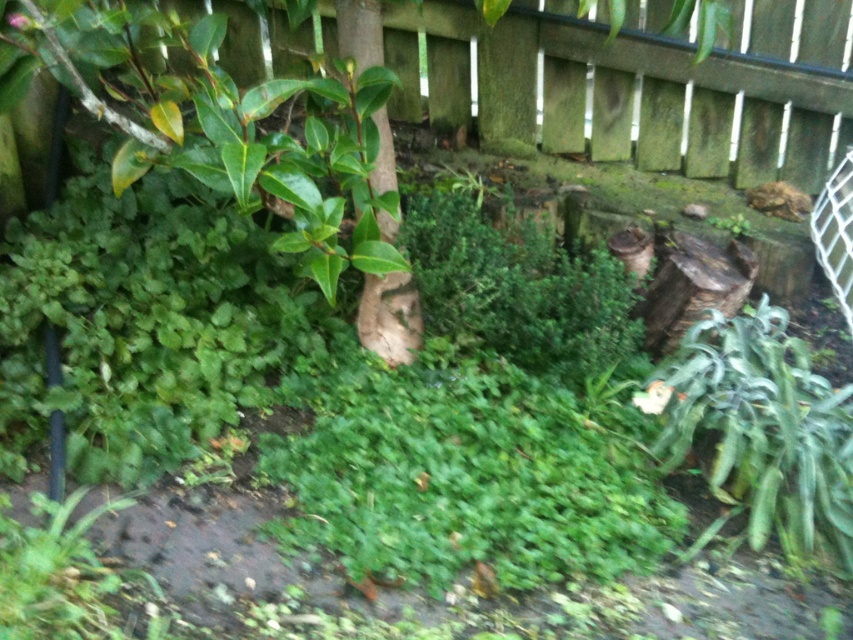
You are standing in the garden described in the scene. You notice a specific point marked at coordinates (463, 474). What is located at this point?

The point at coordinates (463, 474) indicates green leafy grass at center.

You are a gardener holding a 2 meter long pole. You need to reach the green leafy grass at center from where you are standing. Can you reach it with the pole?

The distance between the green leafy grass at center and the camera is 1.98 meters. Since the pole is 2 meters long, you can reach the green leafy grass at center with the pole.